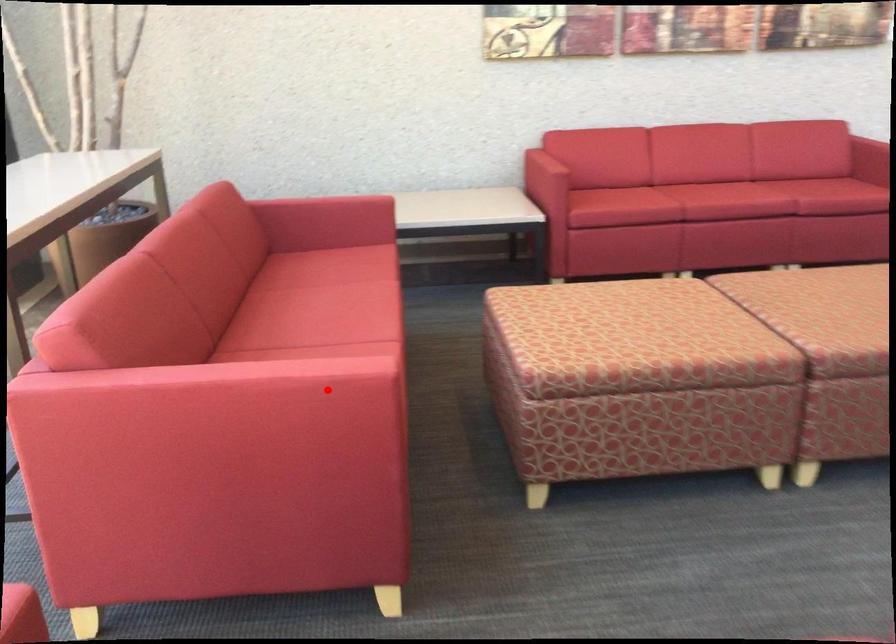
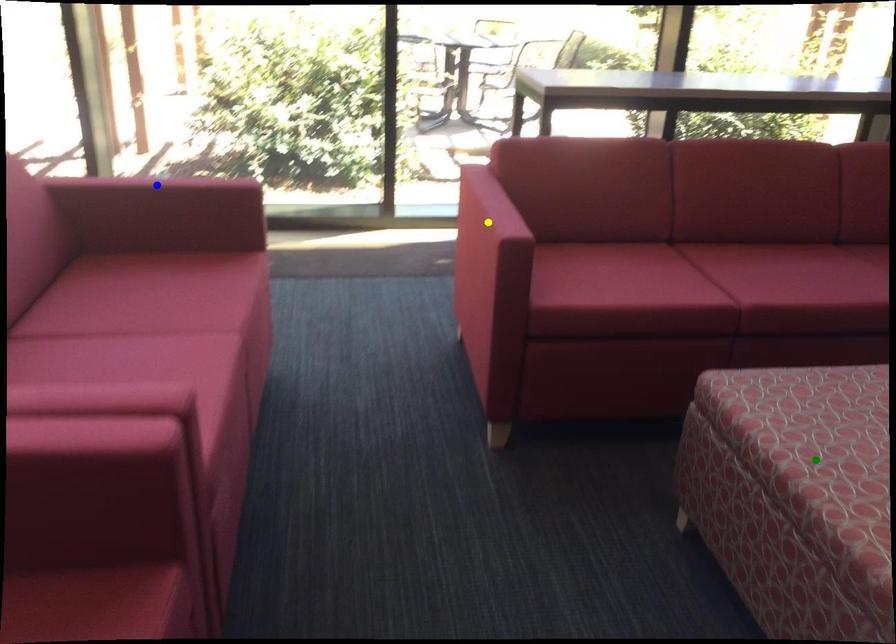
Question: I am providing you with two images of the same scene from different viewpoints. A red point is marked on the first image. You are given multiple points on the second image. Which mark in image 2 goes with the point in image 1?

Choices:
 (A) yellow point
 (B) blue point
 (C) green point

Answer: (A)